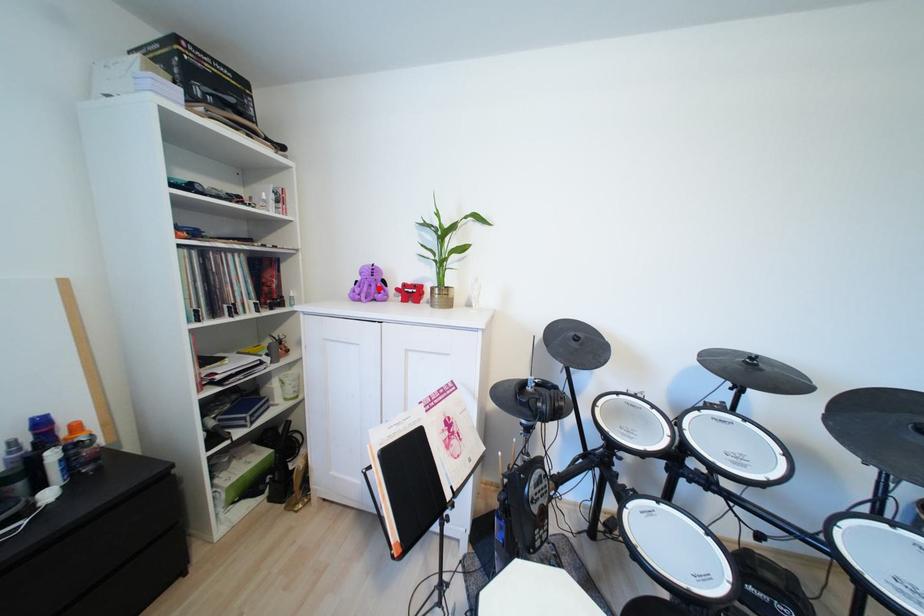
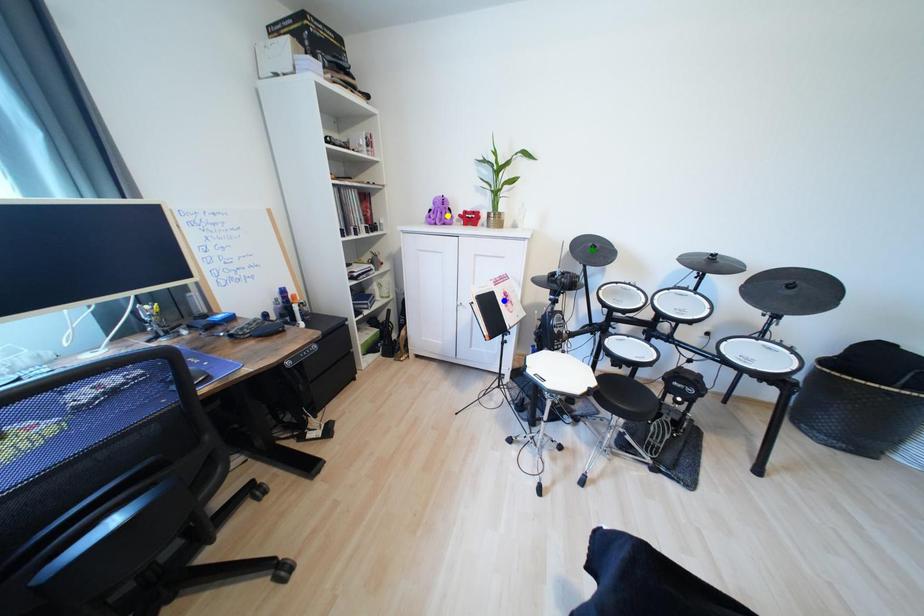
Question: I am providing you with two images of the same scene from different viewpoints. A red point is marked on the first image. You are given multiple points on the second image. Which point in image 2 represents the same 3d spot as the red point in image 1?

Choices:
 (A) green point
 (B) blue point
 (C) yellow point

Answer: (C)